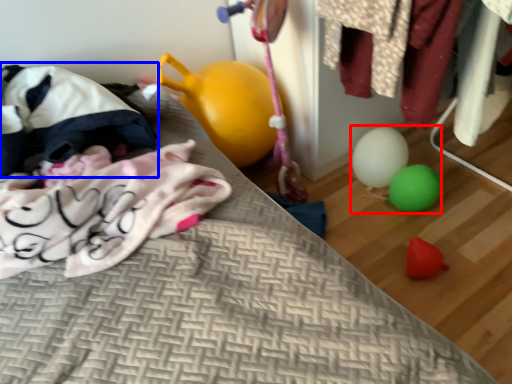
Question: Which object is further to the camera taking this photo, toy (highlighted by a red box) or bean bag chair (highlighted by a blue box)?

Choices:
 (A) toy
 (B) bean bag chair

Answer: (A)